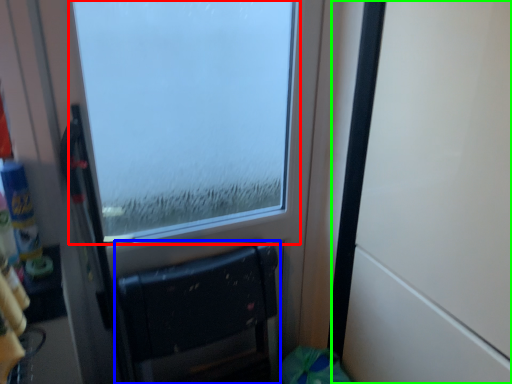
Question: Estimate the real-world distances between objects in this image. Which object is farther from window (highlighted by a red box), furniture (highlighted by a blue box) or door (highlighted by a green box)?

Choices:
 (A) furniture
 (B) door

Answer: (B)